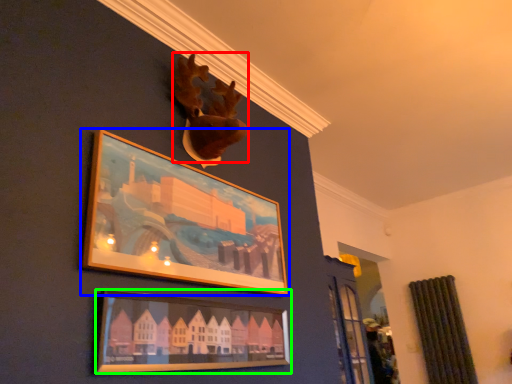
Question: Based on their relative distances, which object is farther from animal (highlighted by a red box)? Choose from picture frame (highlighted by a blue box) and picture frame (highlighted by a green box).

Choices:
 (A) picture frame
 (B) picture frame

Answer: (B)